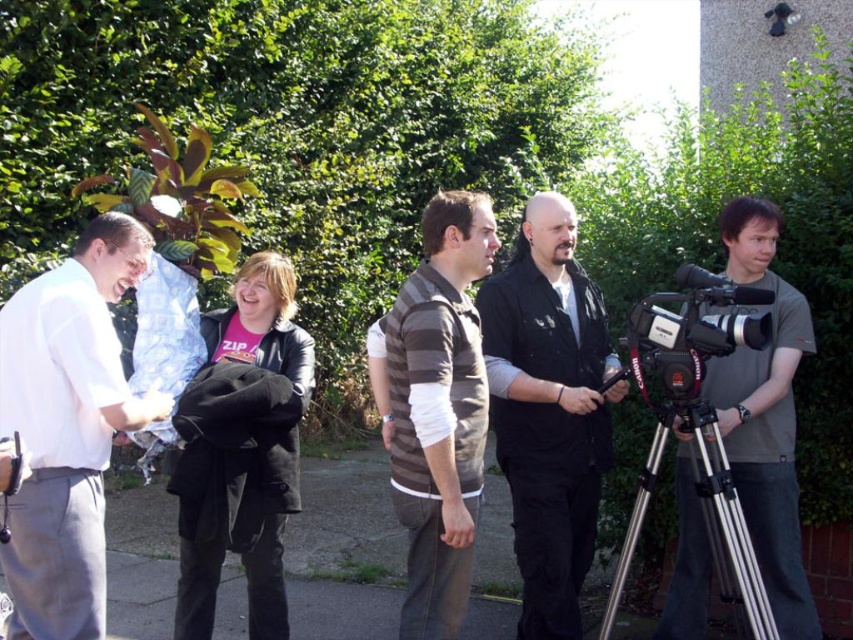
Is striped jersey at center below gray matte camera at right?

No, striped jersey at center is not below gray matte camera at right.

Looking at this image, which of these two, striped jersey at center or gray matte camera at right, stands shorter?

With less height is striped jersey at center.

Which is in front, point (408, 323) or point (753, 272)?

Positioned in front is point (408, 323).

Find the location of a particular element. The width and height of the screenshot is (853, 640). striped jersey at center is located at coordinates (438, 410).

Does white shirt at left appear on the right side of black plastic video camera at right?

In fact, white shirt at left is to the left of black plastic video camera at right.

The image size is (853, 640). Find the location of `white shirt at left`. white shirt at left is located at coordinates (67, 428).

Between point (85, 621) and point (641, 340), which one is positioned in front?

Point (85, 621) is more forward.

Find the location of a particular element. The height and width of the screenshot is (640, 853). white shirt at left is located at coordinates (67, 428).

Is white shirt at left closer to the viewer compared to silver metallic tripod at lower right?

Yes, white shirt at left is in front of silver metallic tripod at lower right.

Is white shirt at left bigger than silver metallic tripod at lower right?

Correct, white shirt at left is larger in size than silver metallic tripod at lower right.

Between point (68, 483) and point (701, 460), which one is positioned in front?

Positioned in front is point (68, 483).

In order to click on white shirt at left in this screenshot , I will do `click(67, 428)`.